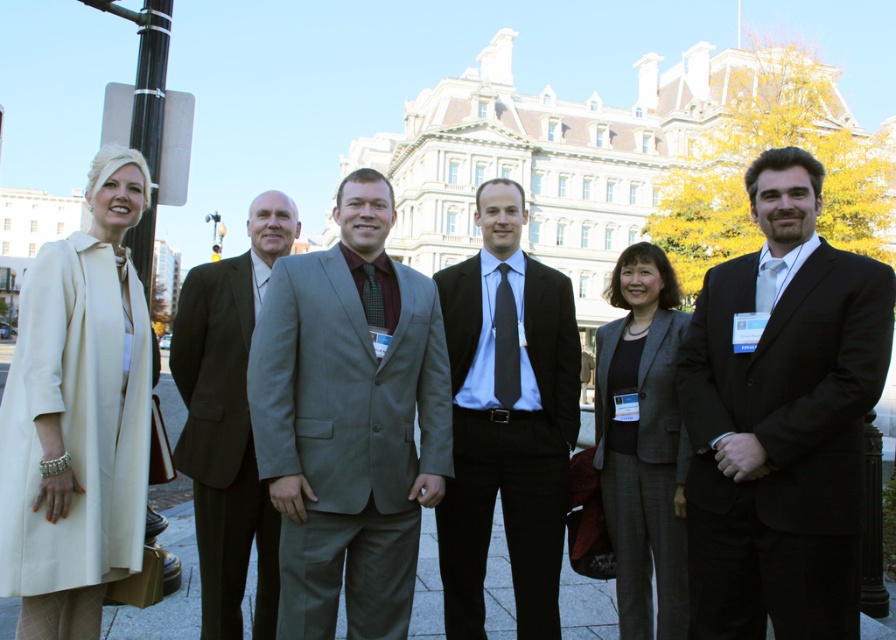
You are a photographer at the event and need to adjust the camera angle to ensure both the creamy satin coat at left and the dark gray suit at center are visible in the photo. Given their positions, which direction should you tilt the camera to include both?

The creamy satin coat at left is located above the dark gray suit at center, so tilting the camera upward will capture both the creamy satin coat at left and the dark gray suit at center.

You are a photographer at the event and need to adjust the lighting so that the black smooth suit at center and dark gray suit at center are both visible. Which suit should you focus the light on first to ensure the darker one isn

The black smooth suit at center is above dark gray suit at center, so you should focus the light on the black smooth suit at center first to ensure the darker one is properly illuminated.